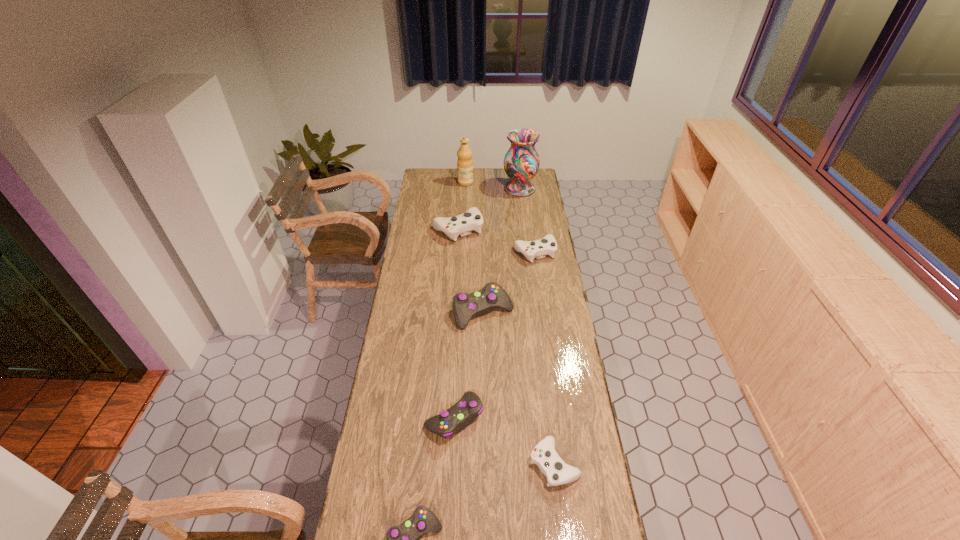
Where is `vacant space that satisfies the following two spatial constraints: 1. on the front side of the tallest object; 2. on the left side of the nearest white control`? vacant space that satisfies the following two spatial constraints: 1. on the front side of the tallest object; 2. on the left side of the nearest white control is located at coordinates (554, 464).

Locate an element on the screen. The height and width of the screenshot is (540, 960). free location that satisfies the following two spatial constraints: 1. on the front side of the biggest white control; 2. on the right side of the farthest gray control is located at coordinates (453, 312).